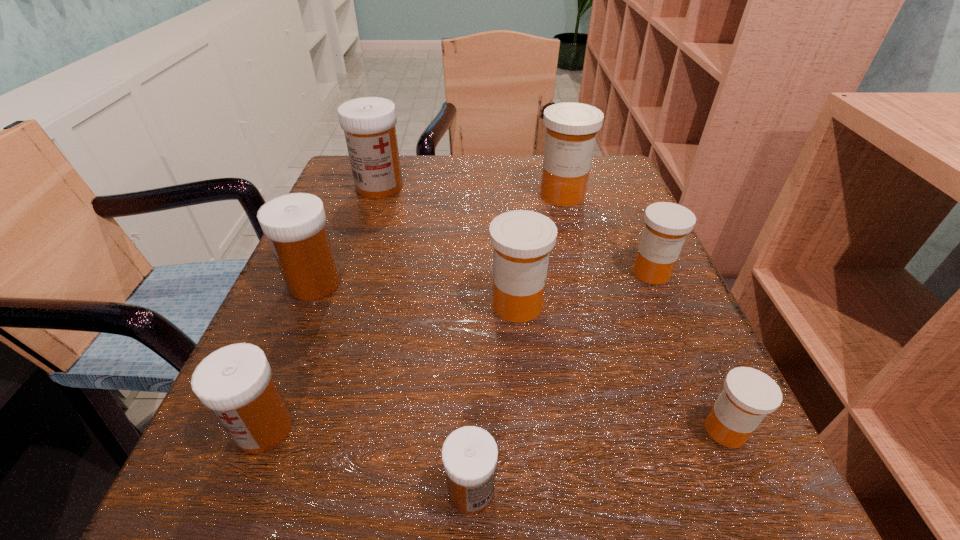
The height and width of the screenshot is (540, 960). In order to click on the farthest white medicine in this screenshot , I will do `click(369, 123)`.

Find the location of a particular element. the third object from right to left is located at coordinates (571, 131).

You are a GUI agent. You are given a task and a screenshot of the screen. Output one action in this format:
    pyautogui.click(x=<x>, y=<y>)
    Task: Click on the biggest orange medicine
    Image resolution: width=960 pixels, height=540 pixels.
    Given the screenshot: What is the action you would take?
    pyautogui.click(x=571, y=131)

The image size is (960, 540). What are the coordinates of `the leftmost orange medicine` in the screenshot? It's located at (522, 240).

At what (x,y) coordinates should I click in order to perform the action: click on the third nearest white medicine. Please return your answer as a coordinate pair (x, y). Looking at the image, I should click on (295, 224).

Identify the location of the third biggest orange medicine. (667, 224).

Identify the location of the third farthest white medicine. (235, 382).

The width and height of the screenshot is (960, 540). I want to click on the smallest orange medicine, so click(749, 395).

What are the coordinates of `the nearest white medicine` in the screenshot? It's located at (469, 454).

I want to click on the smallest white medicine, so click(469, 454).